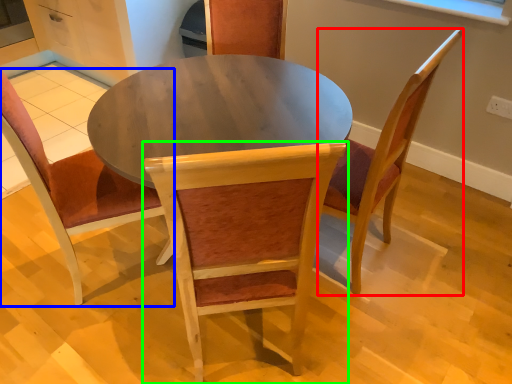
Question: Estimate the real-world distances between objects in this image. Which object is farther from chair (highlighted by a red box), chair (highlighted by a blue box) or chair (highlighted by a green box)?

Choices:
 (A) chair
 (B) chair

Answer: (A)